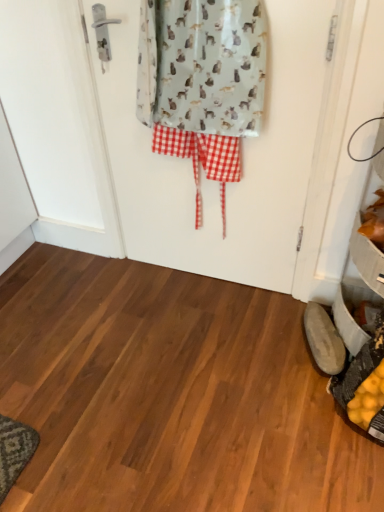
This screenshot has width=384, height=512. Find the location of `vacant space behind brown leather shoe at lower right`. vacant space behind brown leather shoe at lower right is located at coordinates (282, 310).